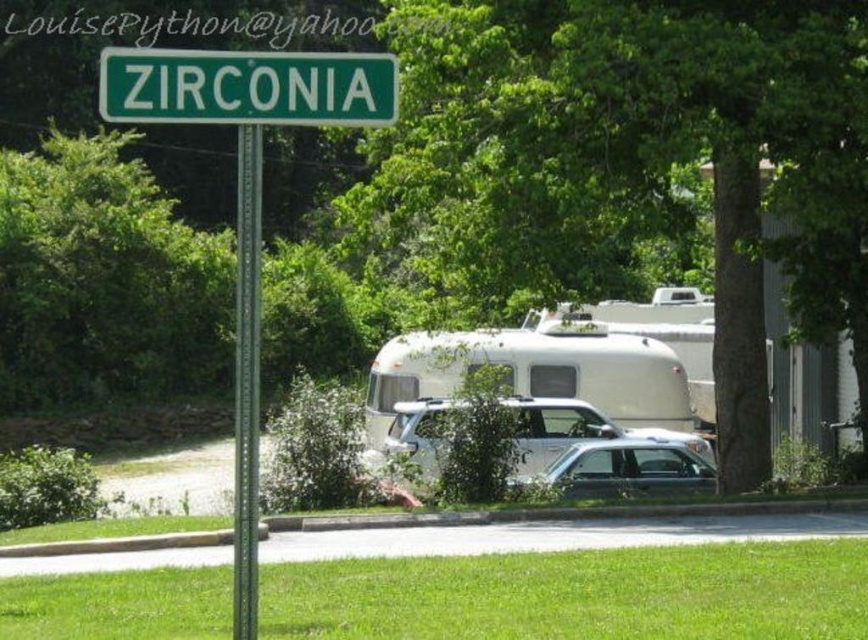
Question: Considering the real-world distances, which object is closest to the green metallic pole at center?

Choices:
 (A) satin silver suv at center
 (B) satin silver sedan at center
 (C) green metallic sign at upper center
 (D) green leafy tree at center

Answer: (C)

Question: Does satin silver suv at center lie behind green metallic pole at center?

Choices:
 (A) yes
 (B) no

Answer: (A)

Question: Where is green metallic sign at upper center located in relation to satin silver suv at center in the image?

Choices:
 (A) above
 (B) below

Answer: (A)

Question: Which of the following is the closest to the observer?

Choices:
 (A) (391, 435)
 (B) (845, 198)

Answer: (B)

Question: Is satin silver suv at center thinner than green metallic pole at center?

Choices:
 (A) no
 (B) yes

Answer: (B)

Question: Which of the following is the closest to the observer?

Choices:
 (A) green metallic pole at center
 (B) green leafy tree at center

Answer: (A)